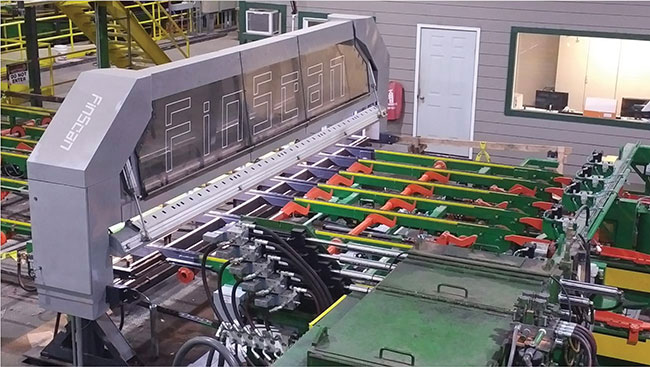
Find the location of a particular element. Image resolution: width=650 pixels, height=367 pixels. left side of door frame is located at coordinates (415, 72).